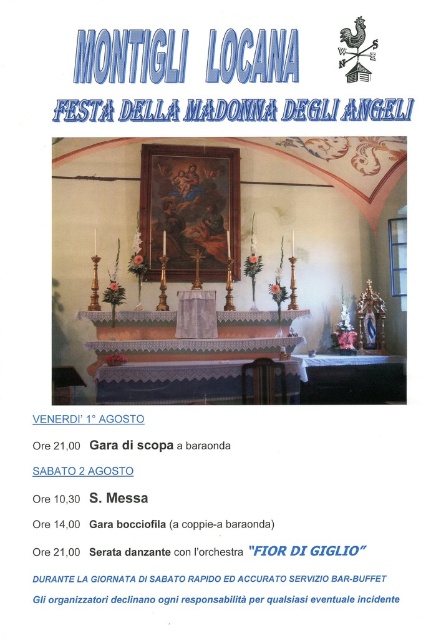
Question: Can you confirm if matte gold altar at center is wider than blue metallic text at upper center?

Choices:
 (A) yes
 (B) no

Answer: (A)

Question: Which point appears farthest from the camera in this image?

Choices:
 (A) (41, 596)
 (B) (374, 260)
 (C) (159, 113)

Answer: (B)

Question: Does matte gold altar at center appear under black paper at lower center?

Choices:
 (A) no
 (B) yes

Answer: (A)

Question: Estimate the real-world distances between objects in this image. Which object is closer to the matte gold altar at center?

Choices:
 (A) black paper at lower center
 (B) blue metallic text at upper center

Answer: (B)

Question: Which point is closer to the camera taking this photo?

Choices:
 (A) (333, 113)
 (B) (293, 596)

Answer: (B)

Question: Is blue metallic text at upper center to the right of black paper at lower center from the viewer's perspective?

Choices:
 (A) no
 (B) yes

Answer: (B)